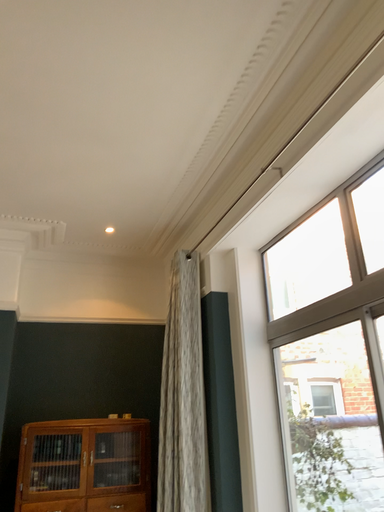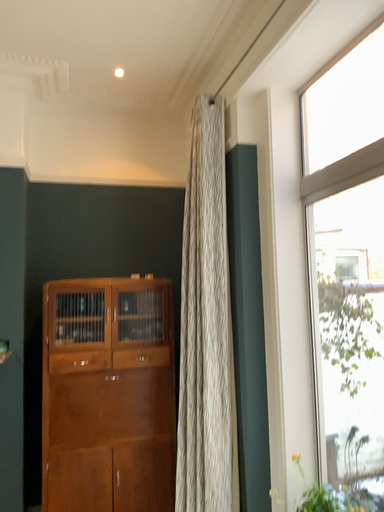
Question: How did the camera likely rotate when shooting the video?

Choices:
 (A) rotated upward
 (B) rotated downward

Answer: (B)